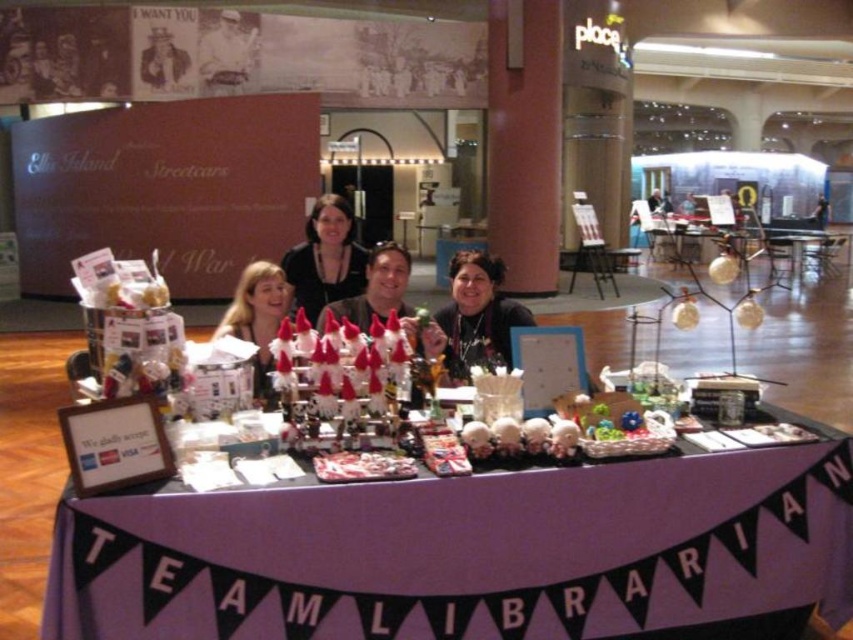
Does purple fabric at center appear on the left side of blonde hair at center?

Incorrect, purple fabric at center is not on the left side of blonde hair at center.

Which is above, purple fabric at center or blonde hair at center?

blonde hair at center is higher up.

Describe the element at coordinates (474, 554) in the screenshot. I see `purple fabric at center` at that location.

You are a GUI agent. You are given a task and a screenshot of the screen. Output one action in this format:
    pyautogui.click(x=<x>, y=<y>)
    Task: Click on the purple fabric at center
    
    Given the screenshot: What is the action you would take?
    pyautogui.click(x=474, y=554)

Is purple fabric at center to the right of matte black sweater at center from the viewer's perspective?

Correct, you'll find purple fabric at center to the right of matte black sweater at center.

Is point (495, 604) more distant than point (479, 280)?

No, (495, 604) is closer to viewer.

Find the location of `purple fabric at center`. purple fabric at center is located at coordinates (474, 554).

Who is positioned more to the left, purple fabric at center or matte black shirt at center?

From the viewer's perspective, matte black shirt at center appears more on the left side.

Does purple fabric at center have a greater height compared to matte black shirt at center?

Indeed, purple fabric at center has a greater height compared to matte black shirt at center.

Does point (157, 540) come closer to viewer compared to point (300, 301)?

Yes, point (157, 540) is closer to viewer.

Find the location of a particular element. The width and height of the screenshot is (853, 640). purple fabric at center is located at coordinates (474, 554).